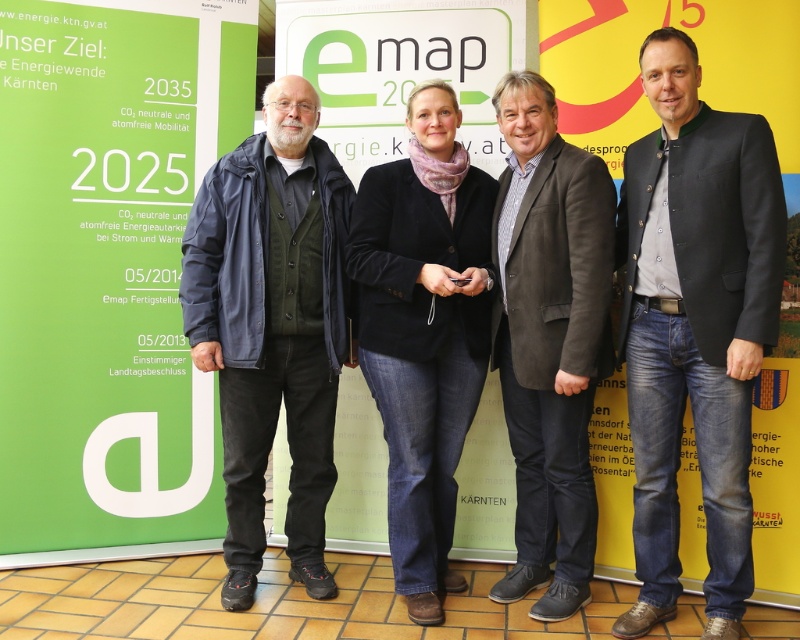
Which of these two, dark gray suit at center or velvet black blazer at center, stands shorter?

Standing shorter between the two is velvet black blazer at center.

Between dark gray suit at center and velvet black blazer at center, which one is positioned lower?

velvet black blazer at center is lower down.

Who is more forward, (722,616) or (430,577)?

Positioned in front is point (722,616).

Image resolution: width=800 pixels, height=640 pixels. In order to click on dark gray suit at center in this screenshot , I will do `click(696, 324)`.

Looking at this image, between green matte sign at center and brown suede jacket at center, which one is positioned higher?

green matte sign at center

Is green matte sign at center bigger than brown suede jacket at center?

Incorrect, green matte sign at center is not larger than brown suede jacket at center.

What do you see at coordinates (402, 67) in the screenshot?
I see `green matte sign at center` at bounding box center [402, 67].

Where is `green matte sign at center`? green matte sign at center is located at coordinates (402, 67).

Between green paperboard sign at left and dark gray suit at center, which one is positioned higher?

green paperboard sign at left

Who is more forward, (130, 497) or (741, 152)?

Point (741, 152) is in front.

I want to click on green paperboard sign at left, so click(110, 269).